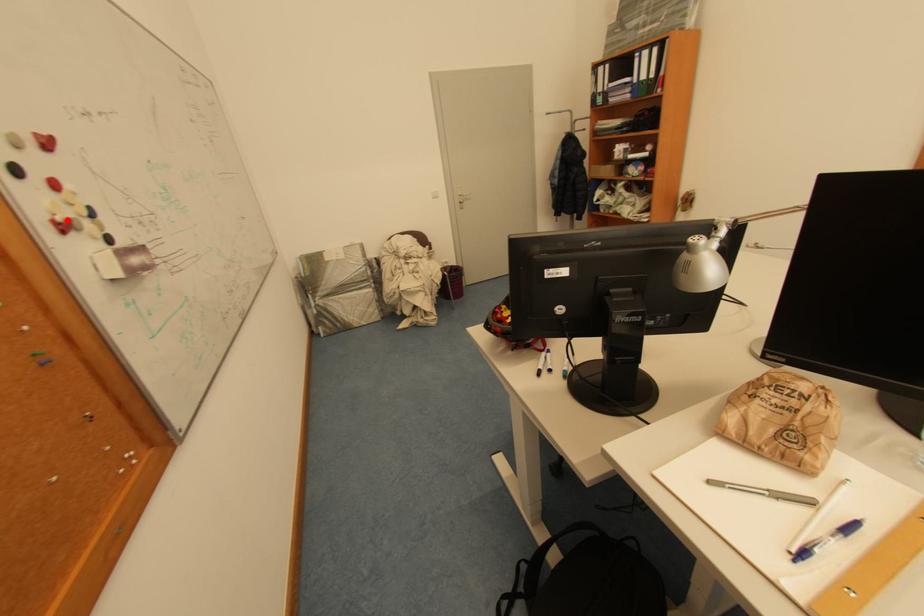
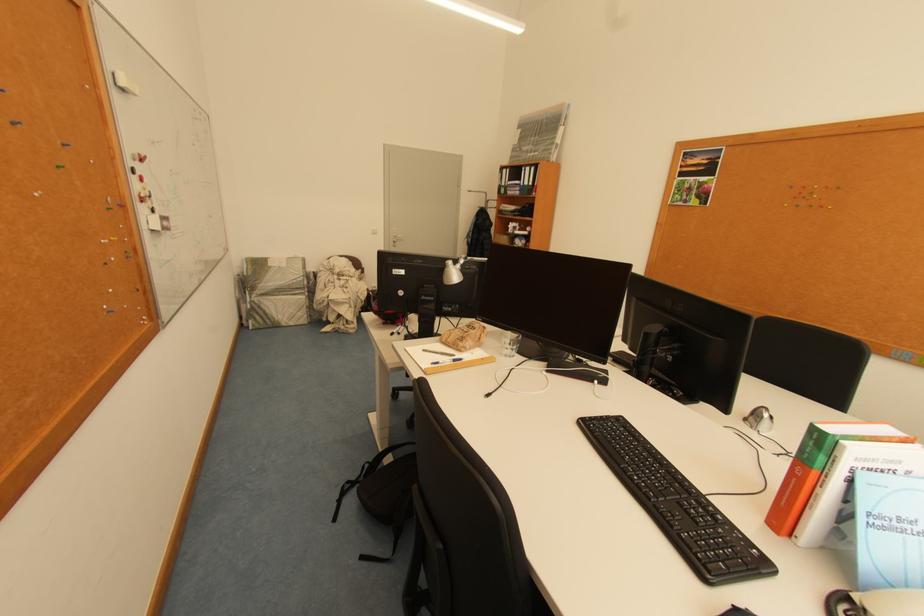
Locate, in the second image, the point that corresponds to the highlighted location in the first image.

(151, 197)